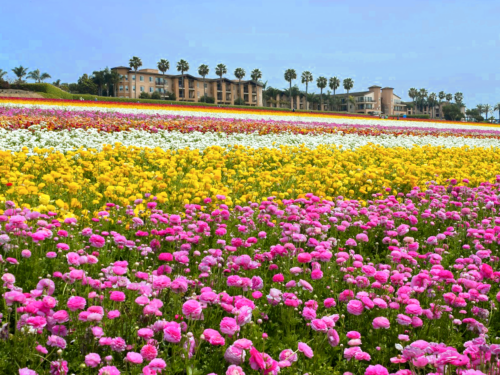
You are a GUI agent. You are given a task and a screenshot of the screen. Output one action in this format:
    pyautogui.click(x=<x>, y=<y>)
    Task: Click on the hotel
    The width and height of the screenshot is (500, 375).
    Given the screenshot: What is the action you would take?
    pyautogui.click(x=216, y=89), pyautogui.click(x=383, y=98)